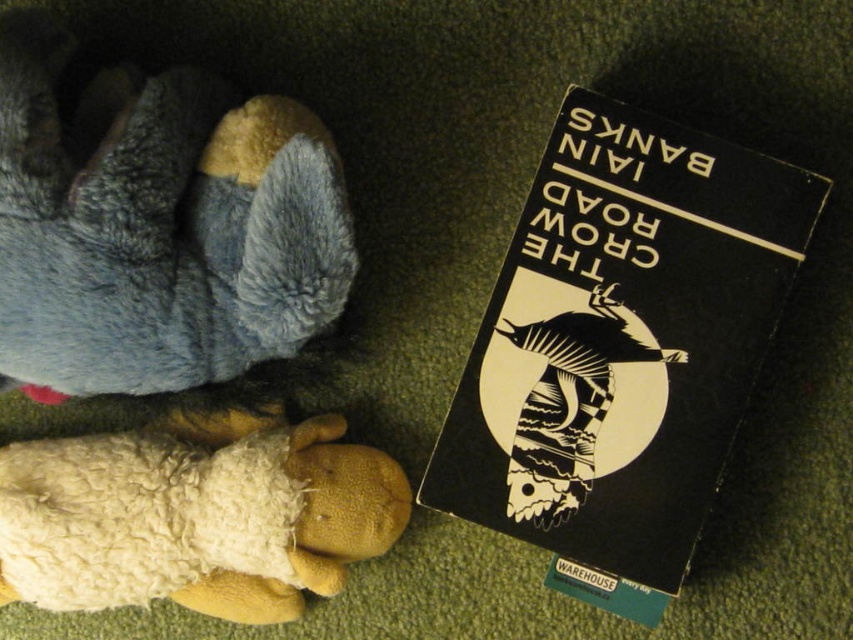
Question: Which object is closer to the camera taking this photo?

Choices:
 (A) white woolen sheep at lower left
 (B) black matte paper at upper right
 (C) gray plush toy at upper left

Answer: (C)

Question: From the image, what is the correct spatial relationship of black matte paper at upper right in relation to gray plush toy at upper left?

Choices:
 (A) below
 (B) above

Answer: (A)

Question: From the image, what is the correct spatial relationship of black matte paper at upper right in relation to gray plush toy at upper left?

Choices:
 (A) left
 (B) right

Answer: (B)

Question: Which point is closer to the camera?

Choices:
 (A) (370, 513)
 (B) (61, 353)
 (C) (451, 440)

Answer: (B)

Question: Among these points, which one is farthest from the camera?

Choices:
 (A) (318, 452)
 (B) (144, 109)
 (C) (730, 444)

Answer: (A)

Question: Is black matte paper at upper right thinner than white woolen sheep at lower left?

Choices:
 (A) no
 (B) yes

Answer: (B)